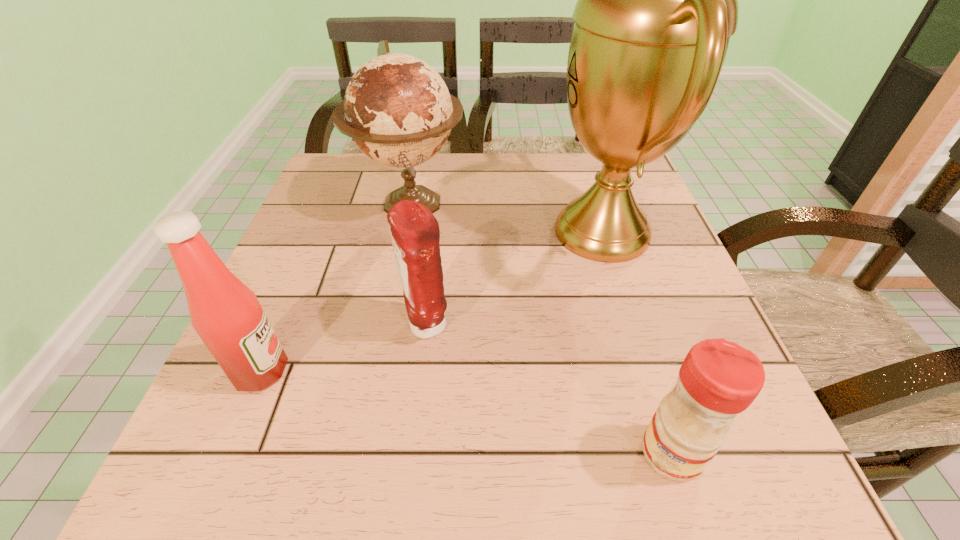
The width and height of the screenshot is (960, 540). I want to click on vacant space located on the front of the globe showing Asia, so click(384, 339).

The image size is (960, 540). Identify the location of vacant space positioned 0.100m on the front-facing side of the tallest condiment. (349, 372).

Find the location of a particular element. vacant space located on the right of the second condiment from right to left is located at coordinates (535, 327).

In order to click on vacant space situated 0.310m on the left of the rightmost condiment in this screenshot , I will do `click(419, 453)`.

Where is `trophy cup present at the far edge`? trophy cup present at the far edge is located at coordinates (657, 0).

Where is `globe positioned at the far edge`? Image resolution: width=960 pixels, height=540 pixels. globe positioned at the far edge is located at coordinates (397, 108).

Image resolution: width=960 pixels, height=540 pixels. I want to click on object situated at the near edge, so click(718, 379).

Image resolution: width=960 pixels, height=540 pixels. What are the coordinates of `globe that is at the left edge` in the screenshot? It's located at (397, 108).

Where is `condiment positioned at the left edge`? The width and height of the screenshot is (960, 540). condiment positioned at the left edge is located at coordinates (226, 314).

At what (x,y) coordinates should I click in order to perform the action: click on trophy cup present at the right edge. Please return your answer as a coordinate pair (x, y). This screenshot has width=960, height=540. Looking at the image, I should click on (657, 0).